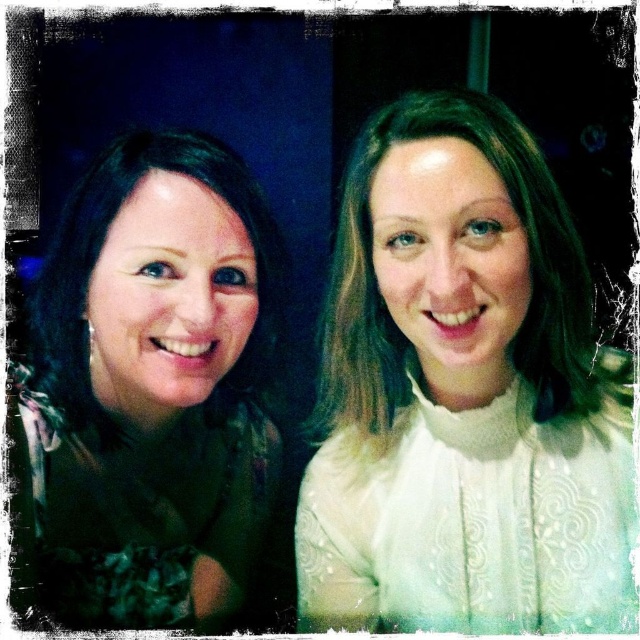
In the scene shown: You are a photographer adjusting the lighting for a portrait. You notice the white lace blouse at right and the matte green dress at left. Which clothing item should you focus your spotlight on to ensure it stands out against the dark background?

The white lace blouse at right is above the matte green dress at left, so focusing the spotlight on the white lace blouse at right would make it stand out more against the dark background due to its higher position and lighter color.

You are a photographer setting up for a portrait. You notice the white lace blouse at right and the matte green dress at left in the image. Based on their positions, which clothing item is closer to the right edge of the frame?

The white lace blouse at right is closer to the right edge of the frame because it is positioned to the right of the matte green dress at left.

You are a photographer trying to decide which subject to focus on. The two subjects are wearing the white lace blouse at right and the matte green dress at left. Which clothing item is larger in size?

The white lace blouse at right is bigger than the matte green dress at left, so the photographer should focus on the white lace blouse at right as it is larger in size.